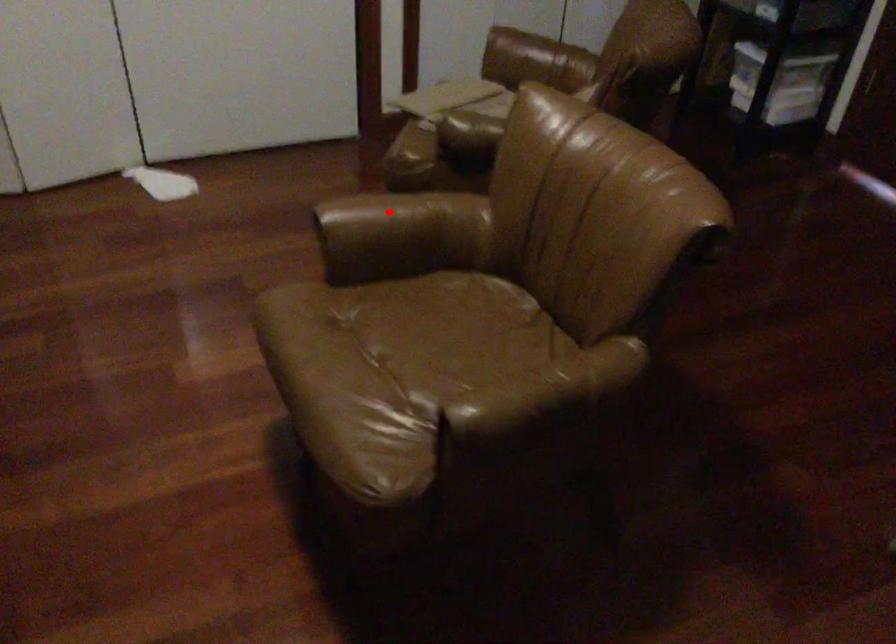
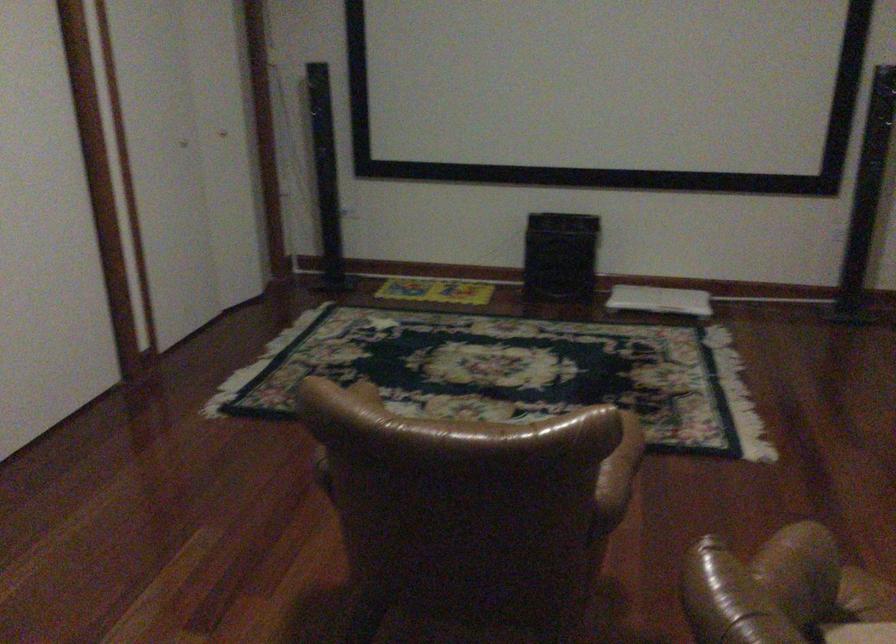
Where in the second image is the point corresponding to the highlighted location from the first image?

(622, 460)